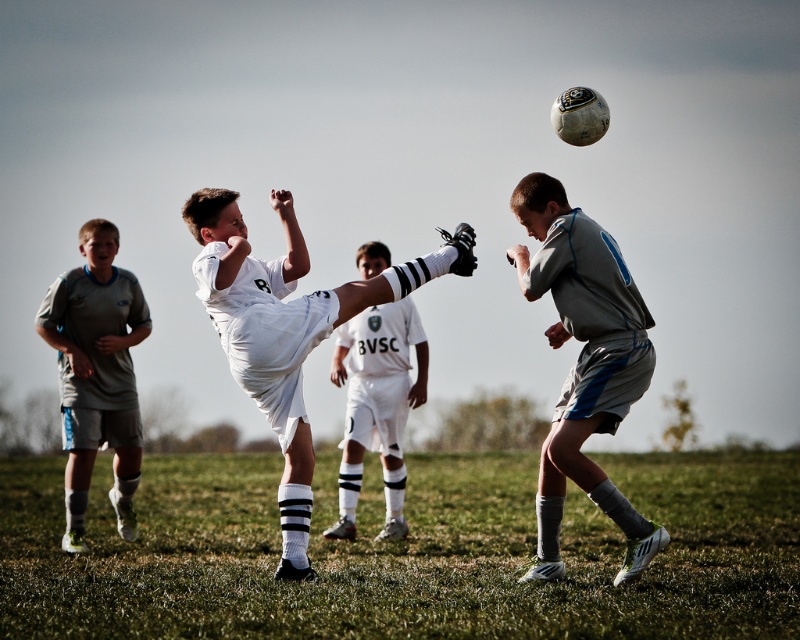
Question: Which object is positioned farthest from the green grass at lower center?

Choices:
 (A) white matte soccer player at center
 (B) white matte soccer jersey at center

Answer: (A)

Question: Is green grass at lower center wider than white matte soccer ball at upper center?

Choices:
 (A) yes
 (B) no

Answer: (A)

Question: Based on their relative distances, which object is nearer to the gray matte shorts at left?

Choices:
 (A) gray fabric shorts at right
 (B) white matte soccer ball at upper center
 (C) white matte soccer jersey at center
 (D) green grass at lower center

Answer: (C)

Question: Is green grass at lower center behind white matte soccer player at center?

Choices:
 (A) yes
 (B) no

Answer: (B)

Question: Does gray fabric shorts at right appear on the right side of white matte soccer jersey at center?

Choices:
 (A) no
 (B) yes

Answer: (B)

Question: Which is farther from the white matte soccer ball at upper center?

Choices:
 (A) green grass at lower center
 (B) white matte soccer jersey at center
 (C) white matte soccer player at center
 (D) gray matte shorts at left

Answer: (A)